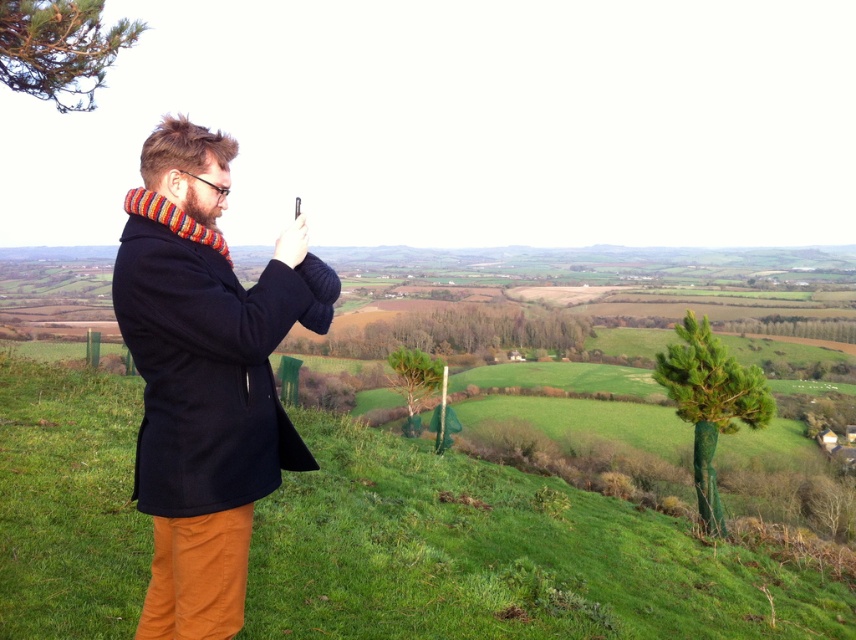
Who is positioned more to the left, green grassy hillside at center or green textured pine at right?

green grassy hillside at center

Can you confirm if green grassy hillside at center is wider than green textured pine at right?

Yes.

Locate an element on the screen. The width and height of the screenshot is (856, 640). green grassy hillside at center is located at coordinates (498, 556).

Who is more forward, (761, 372) or (405, 364)?

Point (761, 372) is more forward.

At what (x,y) coordinates should I click in order to perform the action: click on green textured pine at right. Please return your answer as a coordinate pair (x, y). Image resolution: width=856 pixels, height=640 pixels. Looking at the image, I should click on (710, 403).

Can you confirm if green grassy hillside at center is positioned to the left of dark blue wool coat at center?

Yes, green grassy hillside at center is to the left of dark blue wool coat at center.

Can you confirm if green grassy hillside at center is thinner than dark blue wool coat at center?

In fact, green grassy hillside at center might be wider than dark blue wool coat at center.

Measure the distance between point (496,552) and camera.

The distance of point (496,552) from camera is 6.21 meters.

Image resolution: width=856 pixels, height=640 pixels. Identify the location of green grassy hillside at center. (498, 556).